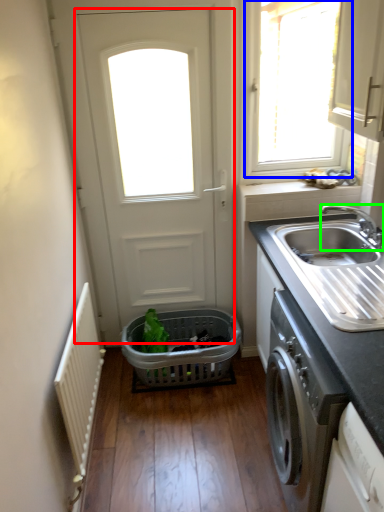
Question: Which object is positioned farthest from door (highlighted by a red box)? Select from window (highlighted by a blue box) and tap (highlighted by a green box).

Choices:
 (A) window
 (B) tap

Answer: (A)